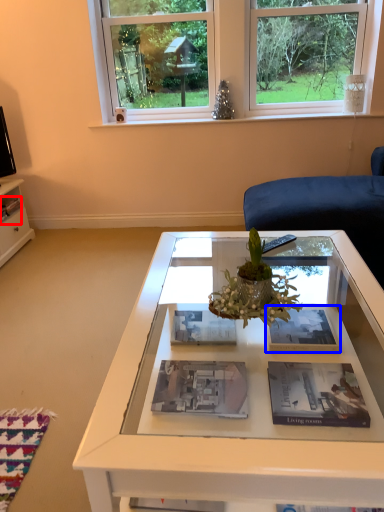
Question: Which point is further to the camera, magazine (highlighted by a red box) or magazine (highlighted by a blue box)?

Choices:
 (A) magazine
 (B) magazine

Answer: (A)